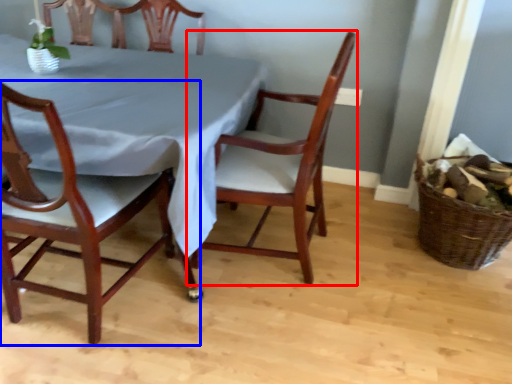
Question: Among these objects, which one is farthest to the camera, chair (highlighted by a red box) or chair (highlighted by a blue box)?

Choices:
 (A) chair
 (B) chair

Answer: (A)